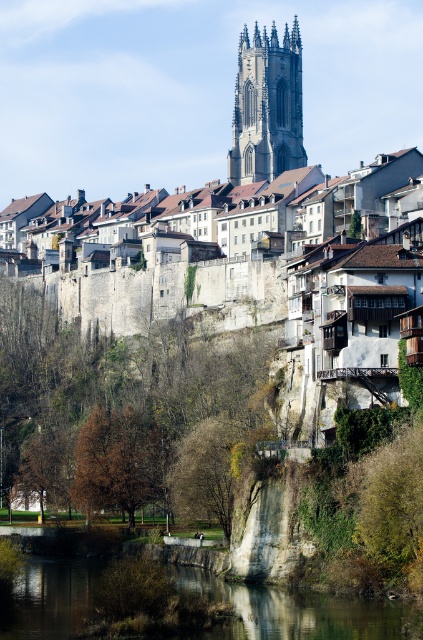
How far apart are green stone river at lower center and smooth stone tower at upper center?

green stone river at lower center is 132.95 meters away from smooth stone tower at upper center.

Describe the element at coordinates (293, 611) in the screenshot. The width and height of the screenshot is (423, 640). I see `green stone river at lower center` at that location.

Does point (375, 636) lie in front of point (299, 67)?

Yes, point (375, 636) is closer to viewer.

Where is `green stone river at lower center`? The width and height of the screenshot is (423, 640). green stone river at lower center is located at coordinates (293, 611).